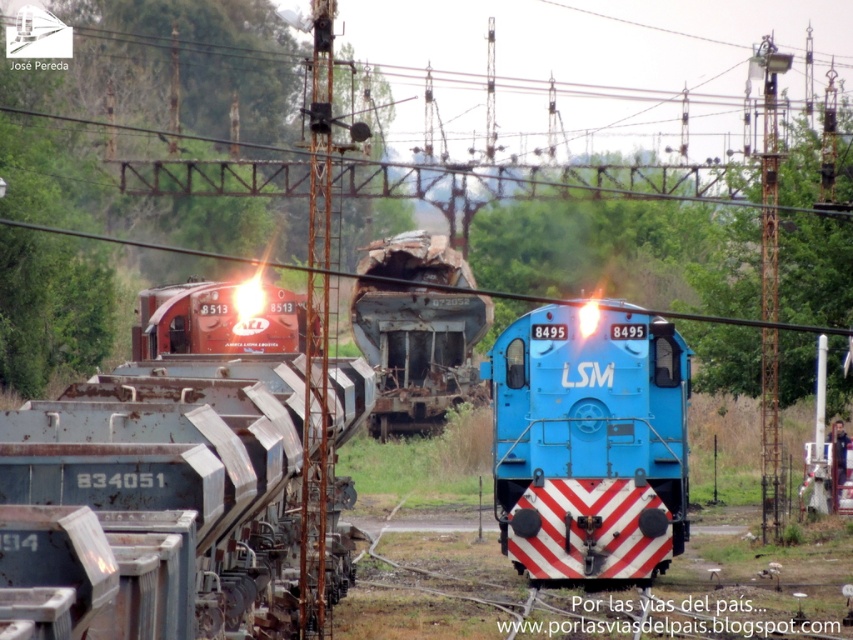
You are a railway inspector standing at the camera position. You need to inspect the rusty metal train car at center. Can you reach it within 50 meters without moving the train?

The rusty metal train car at center is 46.09 meters away from camera, so yes, you can reach it within 50 meters without moving the train.

You are a railway inspector standing at the edge of the tracks. You need to inspect both the blue glossy locomotive at center and the matte red locomotive at center. Which one should you check first if you want to start with the one closer to your current position?

The blue glossy locomotive at center is positioned on the right side of the matte red locomotive at center, so the matte red locomotive at center is closer to your position. You should check the matte red locomotive at center first.

You are a railway inspector checking the tracks. You notice the blue glossy locomotive at center and the rusty metal train car at center. Which one is positioned lower relative to the other?

The blue glossy locomotive at center is positioned below the rusty metal train car at center, so it is lower.